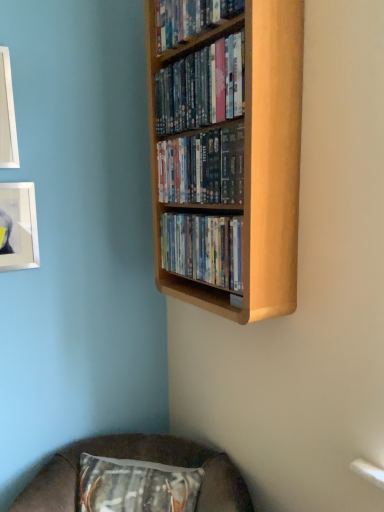
Question: Is metallic silver picture frame at upper left, the first picture frame in the bottom-to-top sequence, facing towards light wood bookcase at upper center?

Choices:
 (A) no
 (B) yes

Answer: (A)

Question: Is metallic silver picture frame at upper left, marked as the second picture frame in a top-to-bottom arrangement, closer to the viewer compared to light wood bookcase at upper center?

Choices:
 (A) no
 (B) yes

Answer: (A)

Question: Is metallic silver picture frame at upper left, the first picture frame in the bottom-to-top sequence, far away from light wood bookcase at upper center?

Choices:
 (A) yes
 (B) no

Answer: (B)

Question: Is light wood bookcase at upper center surrounded by metallic silver picture frame at upper left, the first picture frame in the bottom-to-top sequence?

Choices:
 (A) no
 (B) yes

Answer: (A)

Question: Does metallic silver picture frame at upper left, marked as the second picture frame in a top-to-bottom arrangement, appear on the left side of light wood bookcase at upper center?

Choices:
 (A) no
 (B) yes

Answer: (B)

Question: Considering the relative positions of metallic silver picture frame at upper left, the first picture frame in the bottom-to-top sequence, and light wood bookcase at upper center in the image provided, is metallic silver picture frame at upper left, the first picture frame in the bottom-to-top sequence, behind light wood bookcase at upper center?

Choices:
 (A) no
 (B) yes

Answer: (B)

Question: Is brown fabric cushion at lower center oriented towards metallic silver picture frame at upper left, marked as the second picture frame in a top-to-bottom arrangement?

Choices:
 (A) yes
 (B) no

Answer: (B)

Question: Is brown fabric cushion at lower center positioned with its back to metallic silver picture frame at upper left, marked as the second picture frame in a top-to-bottom arrangement?

Choices:
 (A) no
 (B) yes

Answer: (A)

Question: From the image's perspective, is brown fabric cushion at lower center located above metallic silver picture frame at upper left, the first picture frame in the bottom-to-top sequence?

Choices:
 (A) yes
 (B) no

Answer: (B)

Question: Considering the relative positions of brown fabric cushion at lower center and metallic silver picture frame at upper left, the first picture frame in the bottom-to-top sequence, in the image provided, is brown fabric cushion at lower center to the left of metallic silver picture frame at upper left, the first picture frame in the bottom-to-top sequence, from the viewer's perspective?

Choices:
 (A) yes
 (B) no

Answer: (B)

Question: Is brown fabric cushion at lower center not within metallic silver picture frame at upper left, marked as the second picture frame in a top-to-bottom arrangement?

Choices:
 (A) yes
 (B) no

Answer: (A)

Question: Can you see brown fabric cushion at lower center touching metallic silver picture frame at upper left, marked as the second picture frame in a top-to-bottom arrangement?

Choices:
 (A) yes
 (B) no

Answer: (B)

Question: Is white glossy picture frame at upper left, which is the first picture frame from top to bottom, located outside wooden shelf at upper center, the 3th book from the bottom?

Choices:
 (A) yes
 (B) no

Answer: (A)